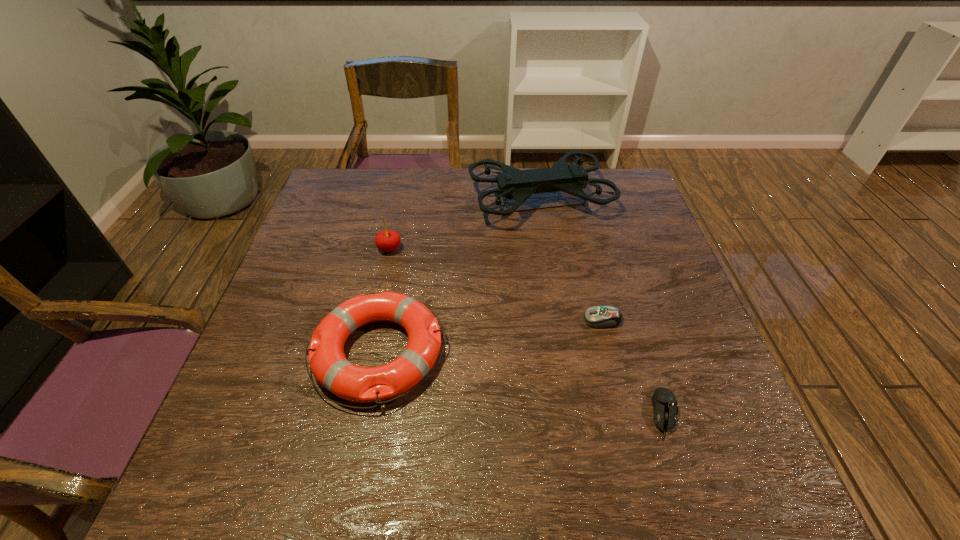
You are a GUI agent. You are given a task and a screenshot of the screen. Output one action in this format:
    pyautogui.click(x=<x>, y=<y>)
    Task: Click on the free space located on the back of the life buoy
    
    Given the screenshot: What is the action you would take?
    pyautogui.click(x=403, y=232)

You are a GUI agent. You are given a task and a screenshot of the screen. Output one action in this format:
    pyautogui.click(x=<x>, y=<y>)
    Task: Click on the vacant area situated on the wheel side of the farther computer mouse
    
    Given the screenshot: What is the action you would take?
    pyautogui.click(x=465, y=320)

Find the location of a particular element. The image size is (960, 540). vacant space situated on the wheel side of the farther computer mouse is located at coordinates (521, 320).

At what (x,y) coordinates should I click in order to perform the action: click on blank area located on the wheel side of the farther computer mouse. Please return your answer as a coordinate pair (x, y). Looking at the image, I should click on (504, 320).

I want to click on vacant space situated 0.130m on the back of the shortest object, so 639,336.

You are a GUI agent. You are given a task and a screenshot of the screen. Output one action in this format:
    pyautogui.click(x=<x>, y=<y>)
    Task: Click on the object that is at the far edge
    The width and height of the screenshot is (960, 540).
    Given the screenshot: What is the action you would take?
    pyautogui.click(x=516, y=184)

The image size is (960, 540). Find the location of `object at the left edge`. object at the left edge is located at coordinates (329, 365).

Locate an element on the screen. This screenshot has height=540, width=960. drone present at the right edge is located at coordinates (x=516, y=184).

This screenshot has height=540, width=960. I want to click on computer mouse situated at the right edge, so click(x=665, y=407).

Find the location of a particular element. This screenshot has width=960, height=540. object at the far right corner is located at coordinates (516, 184).